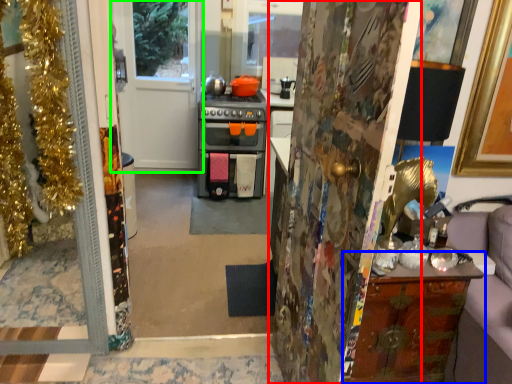
Question: Based on their relative distances, which object is nearer to door (highlighted by a red box)? Choose from cabinetry (highlighted by a blue box) and door (highlighted by a green box).

Choices:
 (A) cabinetry
 (B) door

Answer: (A)